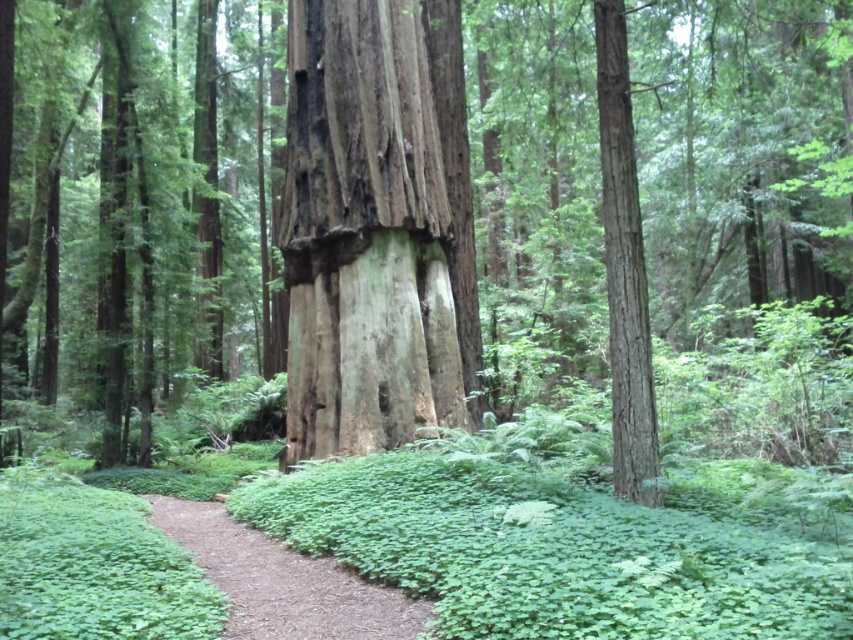
Question: Which of these objects is positioned farthest from the brown dirt path at center?

Choices:
 (A) gray textured tree trunk at center
 (B) smooth brown tree trunk at center-right

Answer: (A)

Question: Which point appears closest to the camera in this image?

Choices:
 (A) (312, 419)
 (B) (602, 192)

Answer: (B)

Question: Which of these objects is positioned closest to the gray textured tree trunk at center?

Choices:
 (A) brown dirt path at center
 (B) smooth brown tree trunk at center-right

Answer: (B)

Question: From the image, what is the correct spatial relationship of gray textured tree trunk at center in relation to brown dirt path at center?

Choices:
 (A) left
 (B) right

Answer: (A)

Question: Can you confirm if gray textured tree trunk at center is positioned to the left of brown dirt path at center?

Choices:
 (A) yes
 (B) no

Answer: (A)

Question: Is brown dirt path at center positioned behind smooth brown tree trunk at center-right?

Choices:
 (A) no
 (B) yes

Answer: (A)